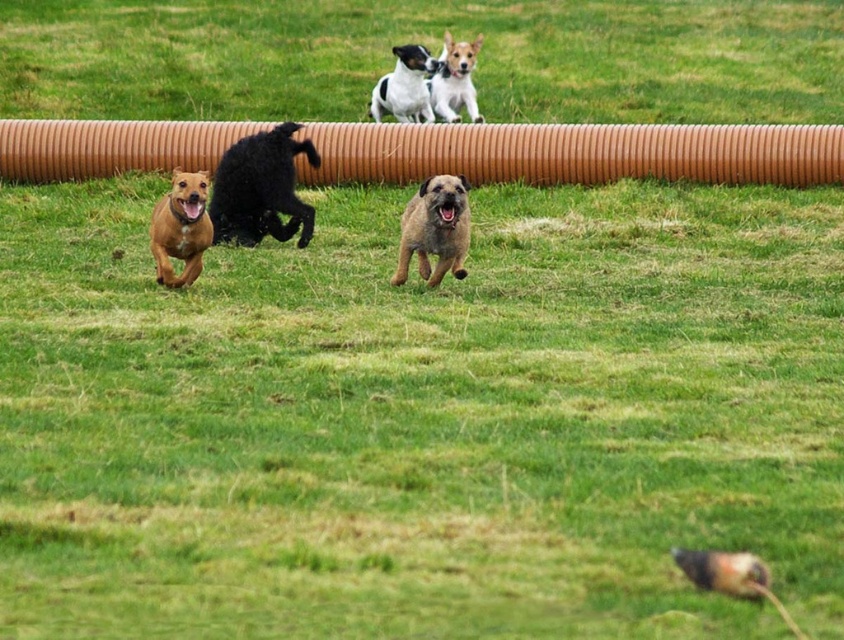
You are a dog owner who wants to ensure your dog can comfortably pass through the brown corrugated pipe at upper center. Given that your smooth tan dog at lower left is 30 cm wide, can the dog fit through the pipe?

The brown corrugated pipe at upper center is bigger than the smooth tan dog at lower left. Since the dog is 30 cm wide, the pipe is wider than that, so the dog can fit through the pipe.

You are standing at point A at point (453, 202) and want to walk to point B which is 32.98 feet away. Is there a clear path between them?

Yes, there is a clear path between point A at point (453, 202) and point B which is 32.98 feet away because the scene depicts a grassy field with dogs playing, but no obstacles blocking the path.